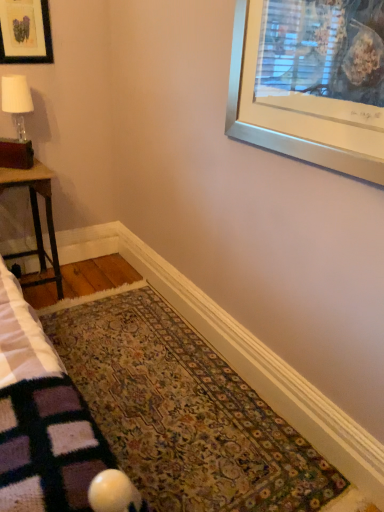
The height and width of the screenshot is (512, 384). Find the location of `vacant area located to the right-hand side of wooden table at left`. vacant area located to the right-hand side of wooden table at left is located at coordinates (85, 291).